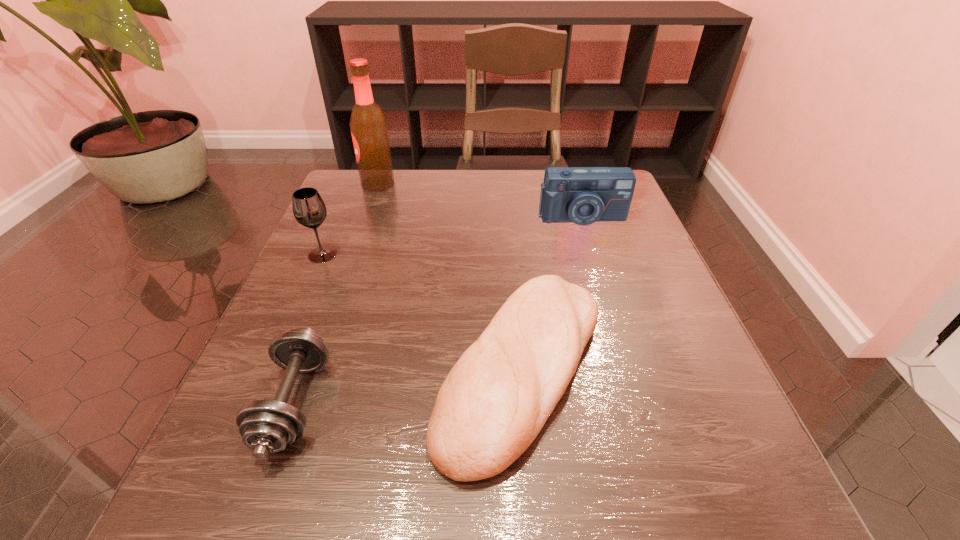
The image size is (960, 540). I want to click on free space at the far left corner, so click(332, 199).

In the image, there is a desktop. At what (x,y) coordinates should I click in order to perform the action: click on free space at the near right corner. Please return your answer as a coordinate pair (x, y). The height and width of the screenshot is (540, 960). Looking at the image, I should click on (642, 482).

The width and height of the screenshot is (960, 540). In order to click on empty location between the camera and the second tallest object in this screenshot , I will do `click(452, 237)`.

The width and height of the screenshot is (960, 540). Identify the location of vacant space that is in between the bread and the dumbbell. (408, 386).

Identify the location of vacant area between the bread and the beer bottle. (450, 276).

You are a GUI agent. You are given a task and a screenshot of the screen. Output one action in this format:
    pyautogui.click(x=<x>, y=<y>)
    Task: Click on the vacant area between the dumbbell and the tallest object
    
    Given the screenshot: What is the action you would take?
    pyautogui.click(x=337, y=293)

At what (x,y) coordinates should I click in order to perform the action: click on vacant space that's between the third farthest object and the beer bottle. Please return your answer as a coordinate pair (x, y). Looking at the image, I should click on (350, 219).

Locate an element on the screen. The image size is (960, 540). free space between the bread and the tallest object is located at coordinates (450, 276).

The width and height of the screenshot is (960, 540). In order to click on free space between the bread and the dumbbell in this screenshot , I will do `click(408, 386)`.

The width and height of the screenshot is (960, 540). Identify the location of unoccupied area between the farthest object and the bread. (450, 276).